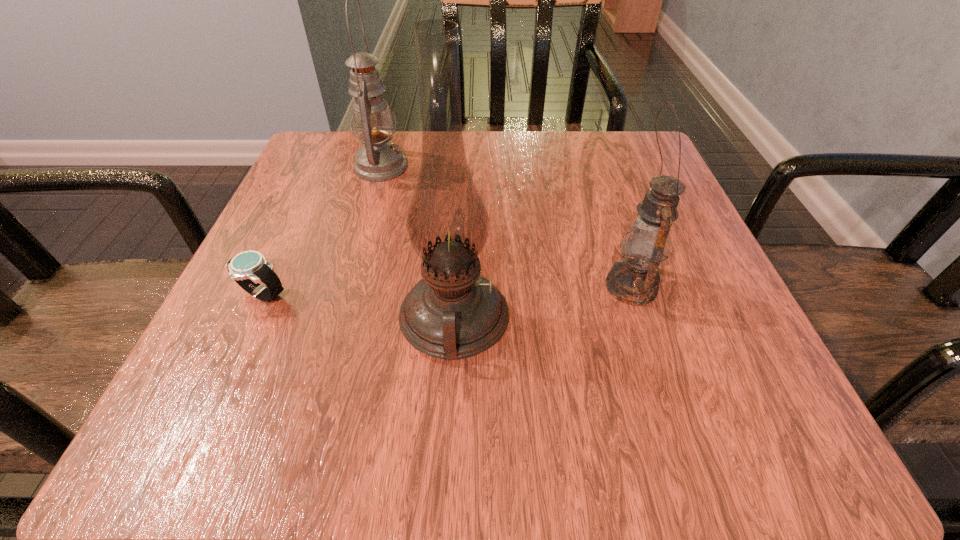
Identify which object is located as the third nearest to the farthest oil lamp. Please provide its 2D coordinates. Your answer should be formatted as a tuple, i.e. [(x, y)], where the tuple contains the x and y coordinates of a point satisfying the conditions above.

[(634, 280)]

You are a GUI agent. You are given a task and a screenshot of the screen. Output one action in this format:
    pyautogui.click(x=<x>, y=<y>)
    Task: Click on the oil lamp object that ranks as the third closest to the watch
    This screenshot has height=540, width=960.
    Given the screenshot: What is the action you would take?
    tap(634, 280)

Where is `the second closest oil lamp to the rightmost oil lamp`? the second closest oil lamp to the rightmost oil lamp is located at coordinates (378, 160).

Find the location of a particular element. Image resolution: width=960 pixels, height=540 pixels. blank space that satisfies the following two spatial constraints: 1. on the back side of the shortest object; 2. on the right side of the farthest object is located at coordinates (322, 167).

Locate an element on the screen. The height and width of the screenshot is (540, 960). free point that satisfies the following two spatial constraints: 1. on the back side of the rightmost oil lamp; 2. on the left side of the shortest object is located at coordinates (267, 286).